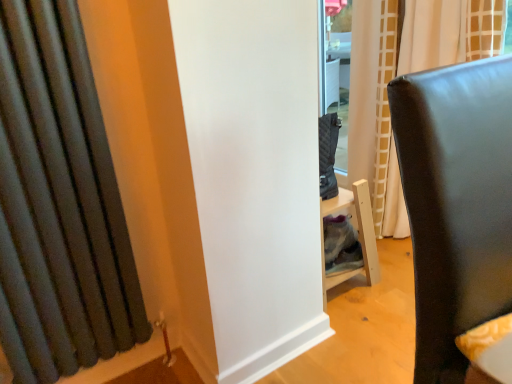
Question: From a real-world perspective, is matte white curtain at center, placed as the second curtain when sorted from left to right, under matte black chair at right?

Choices:
 (A) no
 (B) yes

Answer: (A)

Question: Are matte white curtain at center, which appears as the first curtain when viewed from the right, and matte black chair at right located far from each other?

Choices:
 (A) yes
 (B) no

Answer: (A)

Question: From the image's perspective, does matte white curtain at center, placed as the second curtain when sorted from left to right, appear lower than matte black chair at right?

Choices:
 (A) yes
 (B) no

Answer: (B)

Question: From a real-world perspective, is matte white curtain at center, which appears as the first curtain when viewed from the right, located higher than matte black chair at right?

Choices:
 (A) yes
 (B) no

Answer: (A)

Question: Is matte white curtain at center, which appears as the first curtain when viewed from the right, not inside matte black chair at right?

Choices:
 (A) yes
 (B) no

Answer: (A)

Question: Is the position of matte white curtain at center, placed as the second curtain when sorted from left to right, more distant than that of matte black chair at right?

Choices:
 (A) no
 (B) yes

Answer: (B)

Question: Can you confirm if matte black chair at right is thinner than dark gray fabric curtain at left, acting as the 2th curtain starting from the back?

Choices:
 (A) yes
 (B) no

Answer: (B)

Question: Is matte black chair at right taller than dark gray fabric curtain at left, which is the 1th curtain from front to back?

Choices:
 (A) yes
 (B) no

Answer: (B)

Question: Can you confirm if matte black chair at right is shorter than dark gray fabric curtain at left, marked as the 2th curtain in a right-to-left arrangement?

Choices:
 (A) no
 (B) yes

Answer: (B)

Question: Is matte black chair at right positioned behind dark gray fabric curtain at left, marked as the 2th curtain in a right-to-left arrangement?

Choices:
 (A) no
 (B) yes

Answer: (A)

Question: Does matte black chair at right appear on the left side of dark gray fabric curtain at left, marked as the 2th curtain in a right-to-left arrangement?

Choices:
 (A) yes
 (B) no

Answer: (B)

Question: Would you say matte black chair at right is outside dark gray fabric curtain at left, acting as the 2th curtain starting from the back?

Choices:
 (A) no
 (B) yes

Answer: (B)

Question: Considering the relative sizes of dark gray fabric curtain at left, acting as the 2th curtain starting from the back, and matte white curtain at center, arranged as the first curtain when viewed from the back, in the image provided, is dark gray fabric curtain at left, acting as the 2th curtain starting from the back, taller than matte white curtain at center, arranged as the first curtain when viewed from the back,?

Choices:
 (A) yes
 (B) no

Answer: (B)